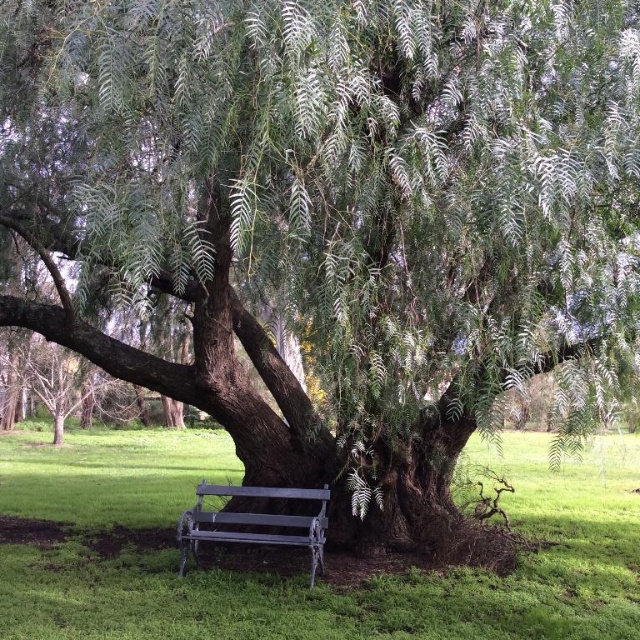
Question: Which object is closer to the camera taking this photo?

Choices:
 (A) green grass at lower center
 (B) metallic gray bench at lower center

Answer: (A)

Question: Can you confirm if green grass at lower center is positioned below metallic gray bench at lower center?

Choices:
 (A) yes
 (B) no

Answer: (A)

Question: Can you confirm if green grass at lower center is positioned below metallic gray bench at lower center?

Choices:
 (A) no
 (B) yes

Answer: (B)

Question: Which object is closer to the camera taking this photo?

Choices:
 (A) green grass at lower center
 (B) metallic gray bench at lower center

Answer: (A)

Question: Which point is closer to the camera?

Choices:
 (A) green grass at lower center
 (B) metallic gray bench at lower center

Answer: (A)

Question: Can you confirm if green grass at lower center is positioned below metallic gray bench at lower center?

Choices:
 (A) no
 (B) yes

Answer: (B)